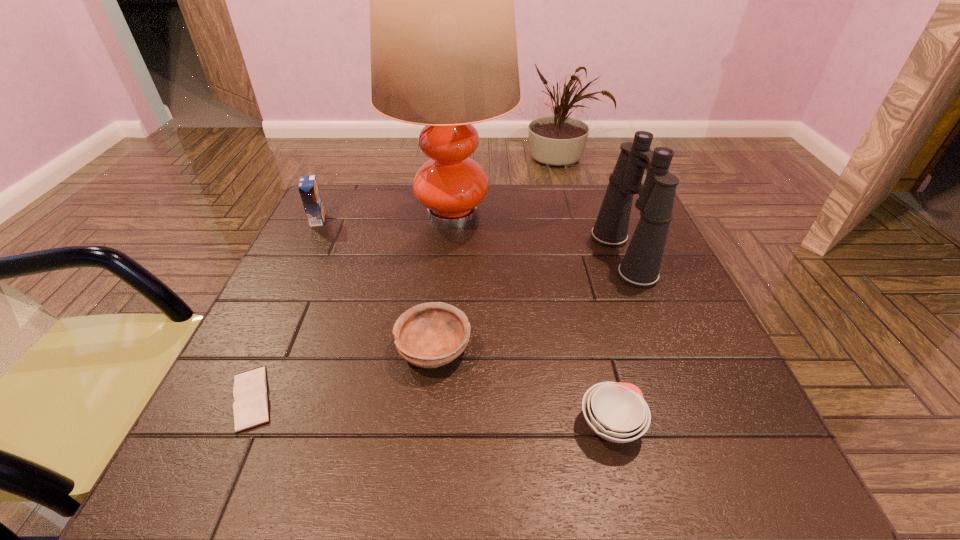
The width and height of the screenshot is (960, 540). In order to click on object situated at the right edge in this screenshot , I will do `click(640, 266)`.

The image size is (960, 540). I want to click on object that is at the far left corner, so click(308, 187).

The width and height of the screenshot is (960, 540). In order to click on object at the near left corner in this screenshot , I will do `click(250, 408)`.

Where is `object at the far right corner`? object at the far right corner is located at coordinates (640, 266).

Identify the location of blank space at the far edge of the desktop. (582, 207).

Locate an element on the screen. The height and width of the screenshot is (540, 960). vacant space at the near edge is located at coordinates (616, 460).

In order to click on vacant region at the left edge in this screenshot , I will do `click(344, 259)`.

The height and width of the screenshot is (540, 960). In order to click on vacant region at the right edge of the desktop in this screenshot , I will do `click(629, 305)`.

Identify the location of vacant area at the far left corner of the desktop. The image size is (960, 540). (369, 203).

The image size is (960, 540). I want to click on free space that is in between the rightmost object and the lamp, so click(x=538, y=235).